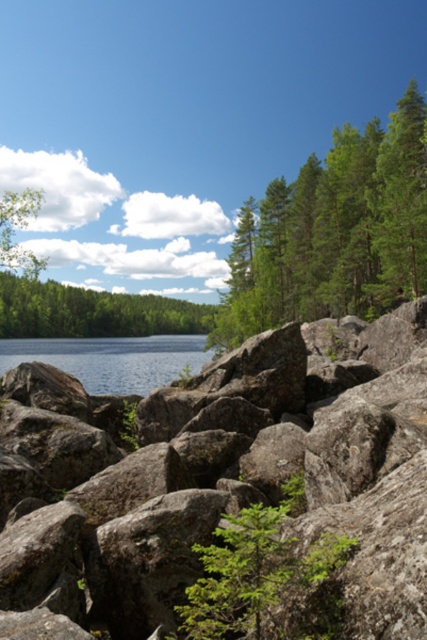
You are standing at the edge of the lake in the image. You see a point marked at coordinates (93, 310). What is located at that point?

The point at coordinates (93, 310) marks green leafy trees at center.

You are standing at the edge of the lake and want to place a small picnic basket between the gray rough boulder at center and the blue water at center. Which object should you place it closer to if you want the basket to be farther from the larger object?

The gray rough boulder at center has a lesser width compared to blue water at center, so placing the picnic basket closer to the gray rough boulder at center would make it farther from the larger blue water at center.

You are a hiker standing at the edge of the rocky foreground in the image. You notice the green leafy tree at center and the green leafy trees at center. How far apart are these two groups of trees from each other?

The green leafy tree at center and the green leafy trees at center are 606.27 feet apart from each other.